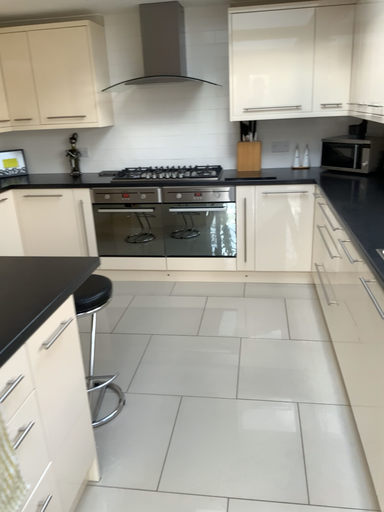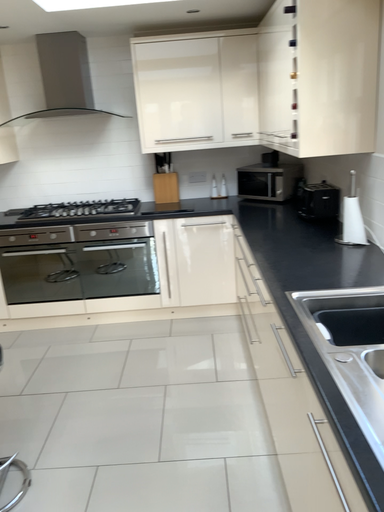
Question: Which way did the camera rotate in the video?

Choices:
 (A) rotated left
 (B) rotated right

Answer: (B)